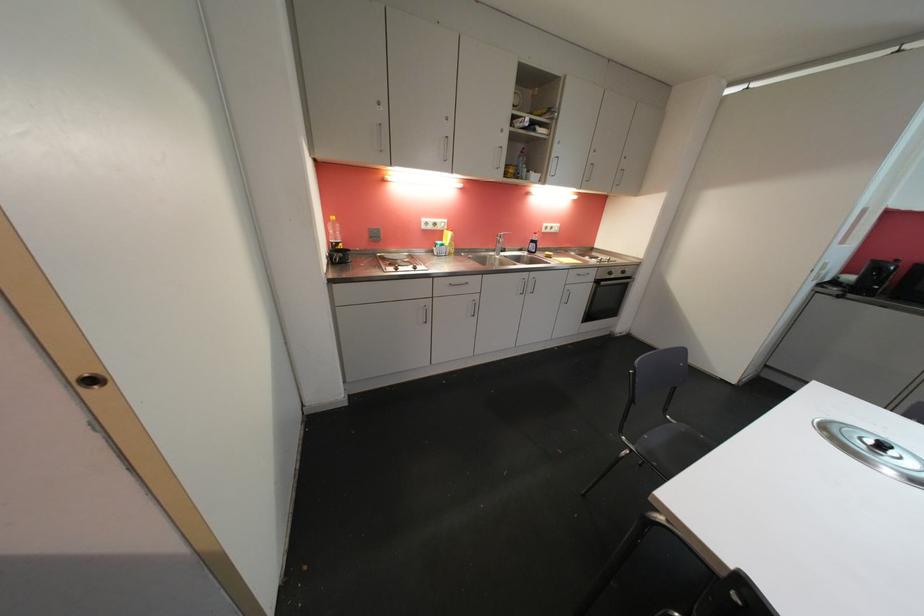
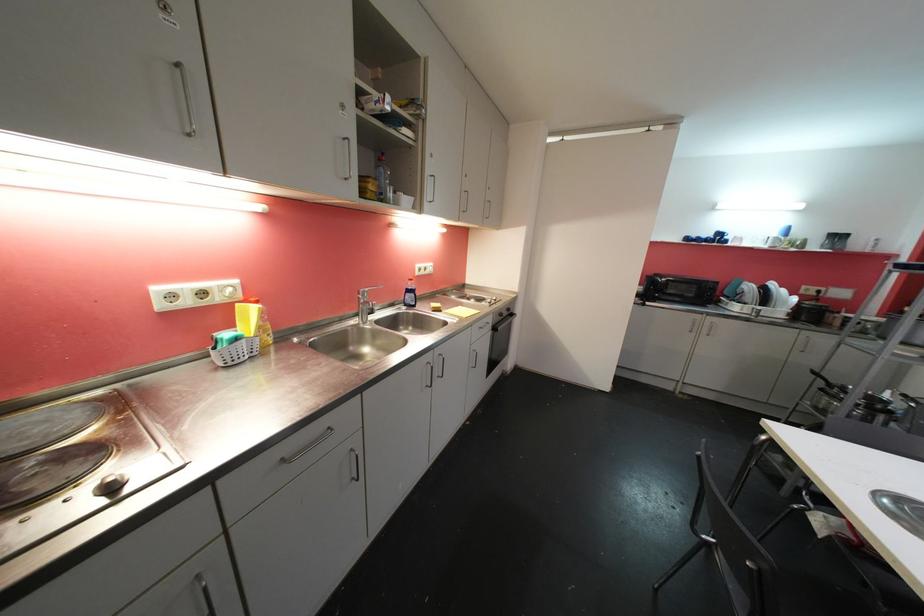
Locate, in the second image, the point that corresponds to (456,241) in the first image.

(265, 322)